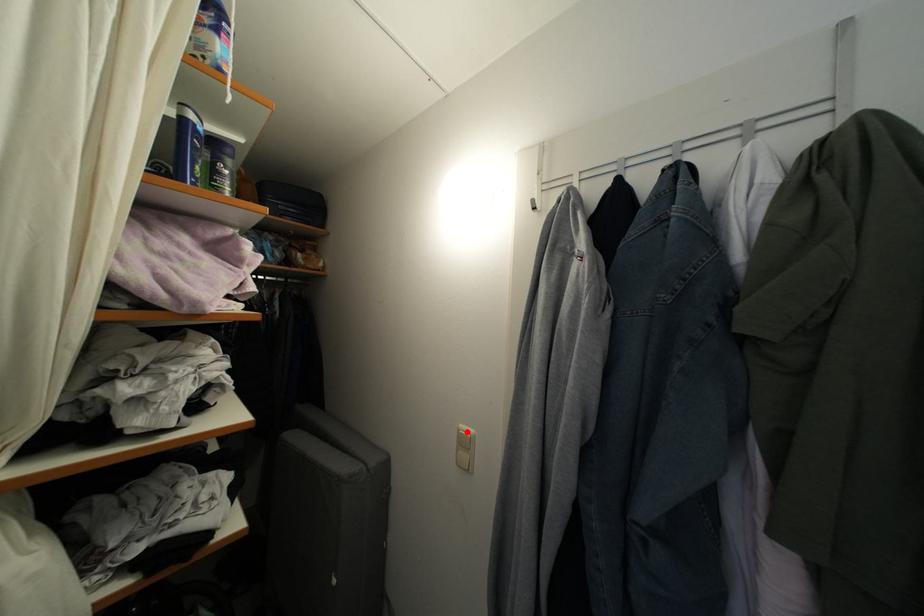
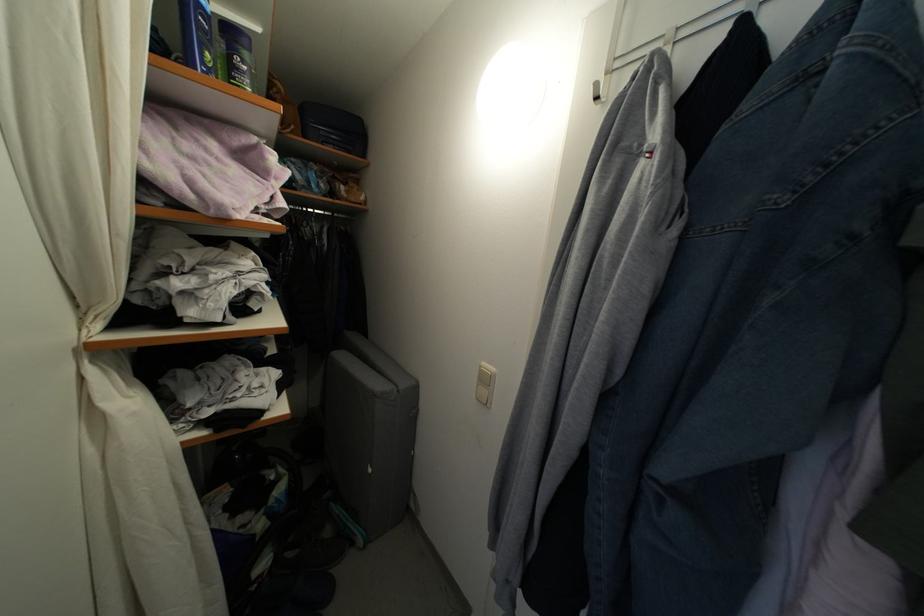
Question: I am providing you with two images of the same scene from different viewpoints. A red point is marked on the first image. Can you still see the location of the red point in image 2?

Choices:
 (A) Yes
 (B) No

Answer: (A)